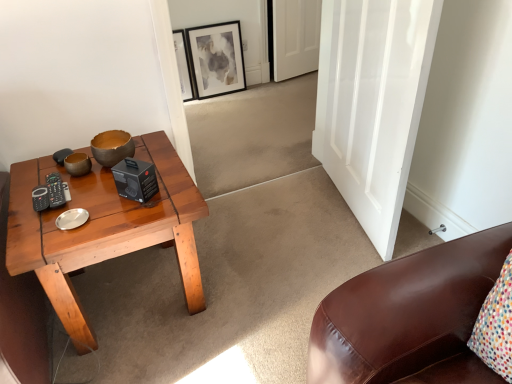
Question: Does matte brown bowl at center appear on the left side of wooden coffee table at left?

Choices:
 (A) yes
 (B) no

Answer: (B)

Question: Is wooden coffee table at left located within matte brown bowl at center?

Choices:
 (A) no
 (B) yes

Answer: (A)

Question: Is matte brown bowl at center closer to the viewer compared to wooden coffee table at left?

Choices:
 (A) no
 (B) yes

Answer: (A)

Question: Considering the relative positions of matte brown bowl at center and wooden coffee table at left in the image provided, is matte brown bowl at center behind wooden coffee table at left?

Choices:
 (A) no
 (B) yes

Answer: (B)

Question: Does matte brown bowl at center have a greater width compared to wooden coffee table at left?

Choices:
 (A) no
 (B) yes

Answer: (A)

Question: From the image's perspective, is matte brown bowl at center located beneath wooden coffee table at left?

Choices:
 (A) no
 (B) yes

Answer: (A)

Question: Is white glossy door at center, marked as the first door in a bottom-to-top arrangement, shorter than wooden coffee table at left?

Choices:
 (A) no
 (B) yes

Answer: (A)

Question: Are white glossy door at center, which is the 2th door from top to bottom, and wooden coffee table at left far apart?

Choices:
 (A) yes
 (B) no

Answer: (B)

Question: Is white glossy door at center, the second door when ordered from back to front, positioned with its back to wooden coffee table at left?

Choices:
 (A) no
 (B) yes

Answer: (A)

Question: Is white glossy door at center, the second door when ordered from back to front, beside wooden coffee table at left?

Choices:
 (A) no
 (B) yes

Answer: (A)

Question: From the image's perspective, would you say white glossy door at center, marked as the first door in a bottom-to-top arrangement, is positioned over wooden coffee table at left?

Choices:
 (A) yes
 (B) no

Answer: (A)

Question: Is white glossy door at center, marked as the first door in a bottom-to-top arrangement, bigger than wooden coffee table at left?

Choices:
 (A) yes
 (B) no

Answer: (B)

Question: Is matte brown bowl at center aimed at matte black picture frame at upper center?

Choices:
 (A) no
 (B) yes

Answer: (A)